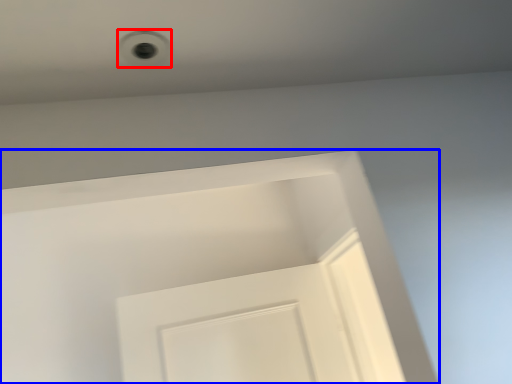
Question: Which point is further to the camera, hole (highlighted by a red box) or screen door (highlighted by a blue box)?

Choices:
 (A) hole
 (B) screen door

Answer: (B)